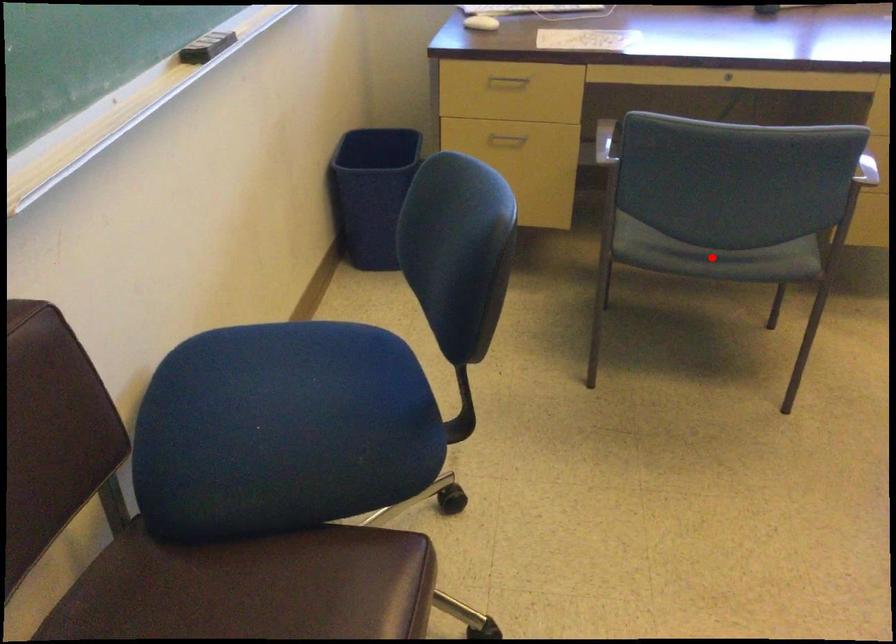
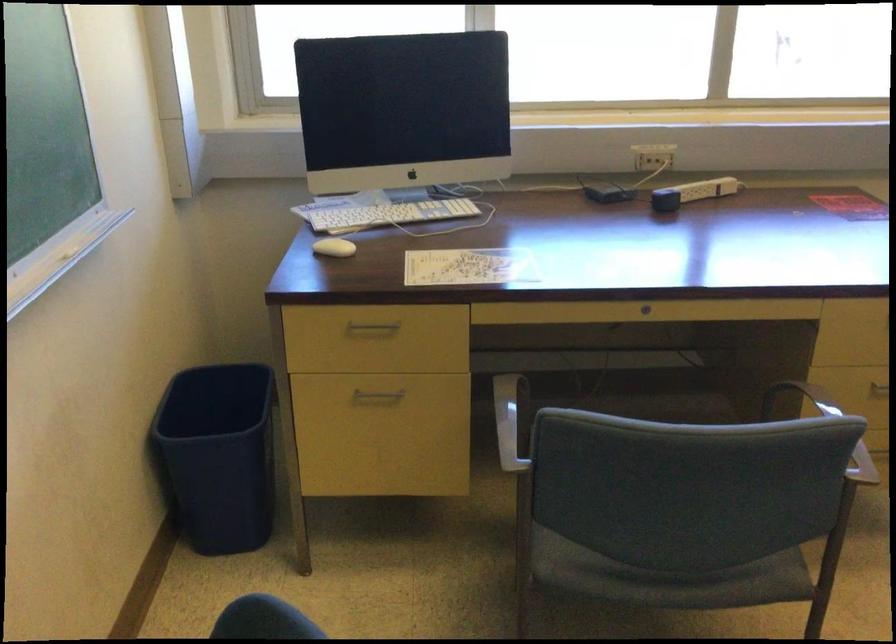
Find the pixel in the second image that matches the highlighted location in the first image.

(668, 578)